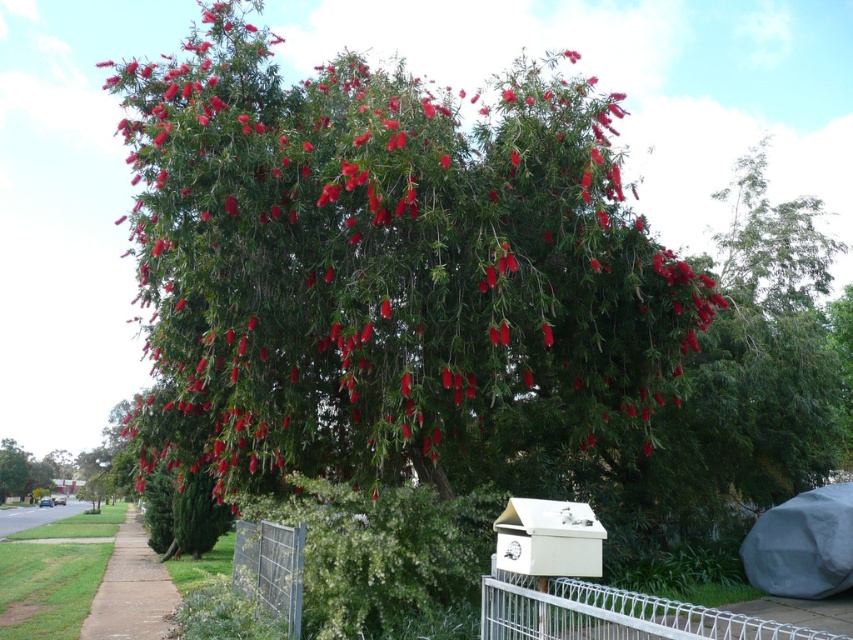
Can you confirm if white wire mesh at lower center is positioned below metallic silver fence at lower center?

Yes.

Which is more to the right, white wire mesh at lower center or metallic silver fence at lower center?

From the viewer's perspective, white wire mesh at lower center appears more on the right side.

Does point (515, 621) come closer to viewer compared to point (238, 561)?

Yes, it is in front of point (238, 561).

This screenshot has height=640, width=853. I want to click on white wire mesh at lower center, so click(610, 612).

Describe the element at coordinates (610, 612) in the screenshot. I see `white wire mesh at lower center` at that location.

Is point (648, 602) farther from camera compared to point (112, 621)?

No, (648, 602) is in front of (112, 621).

Who is more forward, (672, 636) or (149, 600)?

Point (672, 636) is more forward.

Identify the location of white wire mesh at lower center. (610, 612).

Does point (108, 620) come behind point (73, 499)?

No, it is not.

Does brown concrete sidewalk at lower left appear on the left side of brown asphalt at lower left?

No, brown concrete sidewalk at lower left is not to the left of brown asphalt at lower left.

Which is behind, point (86, 618) or point (26, 518)?

The point (26, 518) is more distant.

Where is `brown concrete sidewalk at lower left`? Image resolution: width=853 pixels, height=640 pixels. brown concrete sidewalk at lower left is located at coordinates (131, 589).